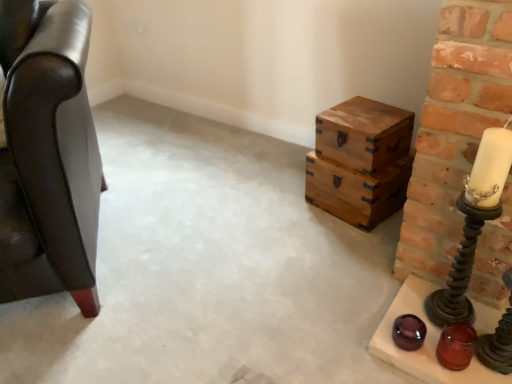
Question: Is wooden crates at right looking in the opposite direction of leather armchair at left?

Choices:
 (A) yes
 (B) no

Answer: (B)

Question: Could you tell me if wooden crates at right is facing leather armchair at left?

Choices:
 (A) yes
 (B) no

Answer: (B)

Question: Does wooden crates at right have a larger size compared to leather armchair at left?

Choices:
 (A) yes
 (B) no

Answer: (B)

Question: From the image's perspective, would you say wooden crates at right is positioned over leather armchair at left?

Choices:
 (A) yes
 (B) no

Answer: (B)

Question: Is wooden crates at right behind leather armchair at left?

Choices:
 (A) yes
 (B) no

Answer: (A)

Question: Does wooden crates at right have a greater width compared to leather armchair at left?

Choices:
 (A) yes
 (B) no

Answer: (B)

Question: Considering the relative positions of leather armchair at left and wooden crates at right in the image provided, is leather armchair at left to the right of wooden crates at right from the viewer's perspective?

Choices:
 (A) yes
 (B) no

Answer: (B)

Question: Is leather armchair at left looking in the opposite direction of wooden crates at right?

Choices:
 (A) yes
 (B) no

Answer: (B)

Question: Is leather armchair at left beside wooden crates at right?

Choices:
 (A) yes
 (B) no

Answer: (B)

Question: From a real-world perspective, is leather armchair at left over wooden crates at right?

Choices:
 (A) no
 (B) yes

Answer: (B)

Question: Does leather armchair at left have a greater width compared to wooden crates at right?

Choices:
 (A) yes
 (B) no

Answer: (A)

Question: Does leather armchair at left turn towards wooden crates at right?

Choices:
 (A) yes
 (B) no

Answer: (B)

Question: Considering the relative sizes of translucent glass candle holder at lower right, which appears as the first candle holder when ordered from the bottom, and metallic spiral candlestick at right, marked as the first candle holder in a top-to-bottom arrangement, in the image provided, is translucent glass candle holder at lower right, which appears as the first candle holder when ordered from the bottom, shorter than metallic spiral candlestick at right, marked as the first candle holder in a top-to-bottom arrangement,?

Choices:
 (A) yes
 (B) no

Answer: (A)